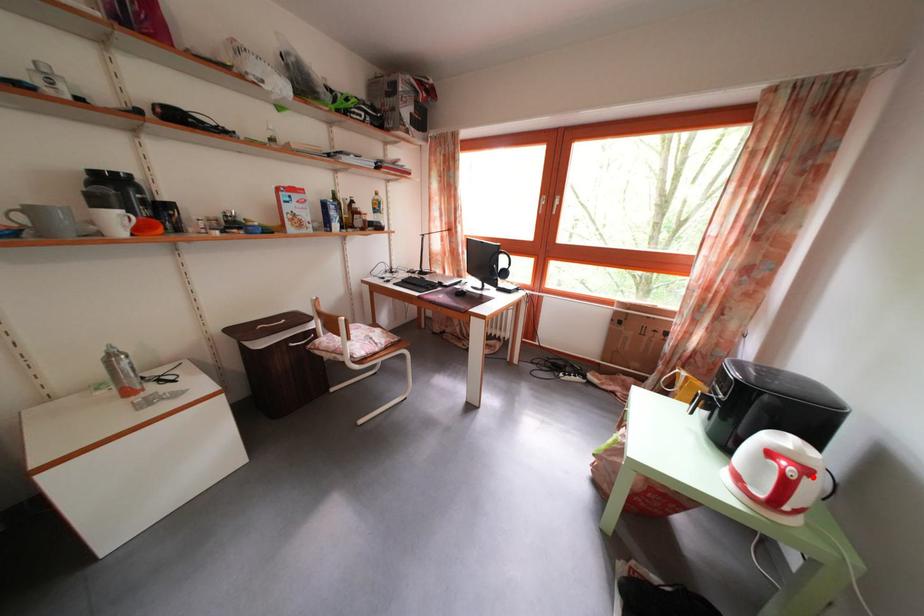
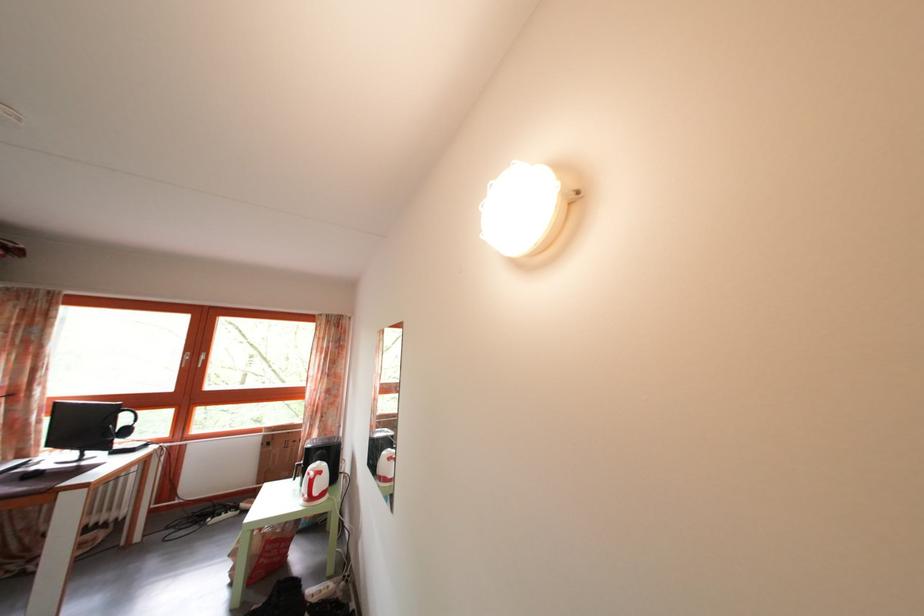
The point at the highlighted location is marked in the first image. Where is the corresponding point in the second image?

(327, 480)